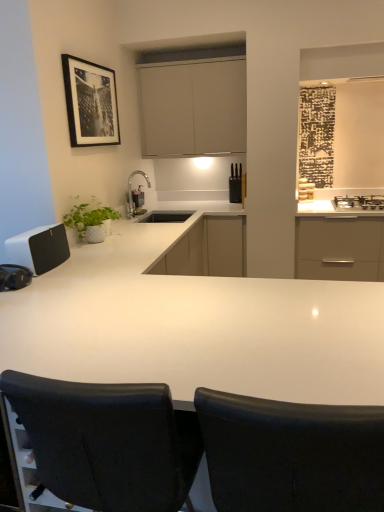
Question: Does white matte cabinet at center, the 1th cabinetry ordered from the bottom, come in front of satin nickel faucet at center?

Choices:
 (A) yes
 (B) no

Answer: (B)

Question: From the image's perspective, is white matte cabinet at center, the 2th cabinetry in the top-to-bottom sequence, located above satin nickel faucet at center?

Choices:
 (A) no
 (B) yes

Answer: (A)

Question: From a real-world perspective, is white matte cabinet at center, the 1th cabinetry ordered from the bottom, positioned over satin nickel faucet at center based on gravity?

Choices:
 (A) no
 (B) yes

Answer: (A)

Question: Is white matte cabinet at center, the 2th cabinetry in the top-to-bottom sequence, wider than satin nickel faucet at center?

Choices:
 (A) yes
 (B) no

Answer: (A)

Question: Considering the relative sizes of white matte cabinet at center, the 1th cabinetry ordered from the bottom, and satin nickel faucet at center in the image provided, is white matte cabinet at center, the 1th cabinetry ordered from the bottom, smaller than satin nickel faucet at center?

Choices:
 (A) yes
 (B) no

Answer: (B)

Question: Does white matte cabinet at center, the 1th cabinetry ordered from the bottom, appear on the right side of satin nickel faucet at center?

Choices:
 (A) yes
 (B) no

Answer: (A)

Question: From a real-world perspective, is white matte speaker at left, acting as the 1th appliance starting from the front, below black plastic knife block at upper center, the second appliance positioned from the left?

Choices:
 (A) yes
 (B) no

Answer: (A)

Question: From the image's perspective, does white matte speaker at left, which appears as the first appliance when viewed from the left, appear lower than black plastic knife block at upper center, which is counted as the 2th appliance, starting from the front?

Choices:
 (A) no
 (B) yes

Answer: (B)

Question: Can you confirm if white matte speaker at left, arranged as the 2th appliance when viewed from the right, is wider than black plastic knife block at upper center, arranged as the 1th appliance when viewed from the right?

Choices:
 (A) no
 (B) yes

Answer: (B)

Question: Is white matte speaker at left, which ranks as the second appliance in back-to-front order, bigger than black plastic knife block at upper center, the 1th appliance from the back?

Choices:
 (A) no
 (B) yes

Answer: (B)

Question: Is white matte speaker at left, which ranks as the second appliance in back-to-front order, outside of black plastic knife block at upper center, the 1th appliance from the back?

Choices:
 (A) yes
 (B) no

Answer: (A)

Question: Would you say black leather chair at center, placed as the 2th chair when sorted from right to left, contains black leather chair at center, which ranks as the first chair in right-to-left order?

Choices:
 (A) no
 (B) yes

Answer: (A)